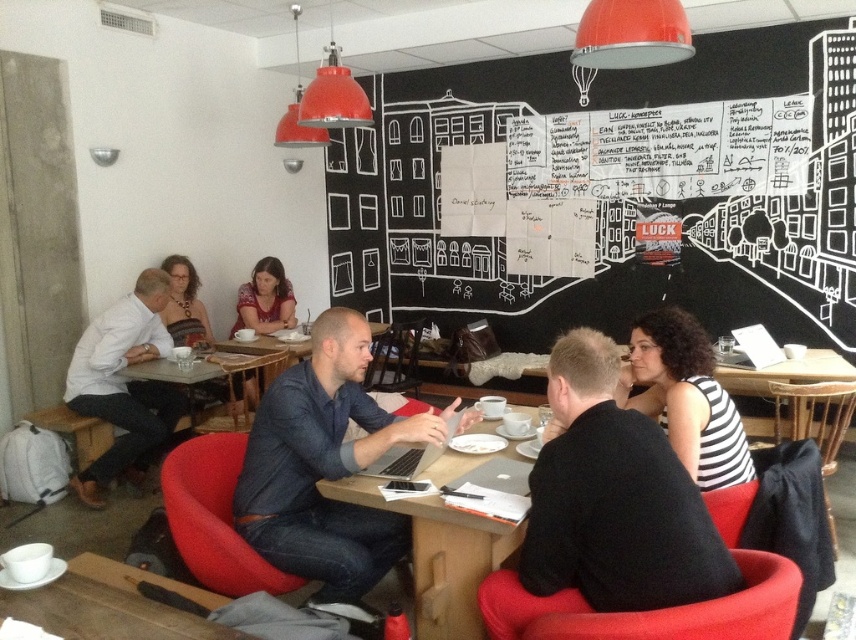
This screenshot has height=640, width=856. What do you see at coordinates (441, 556) in the screenshot?
I see `wooden table at center` at bounding box center [441, 556].

The width and height of the screenshot is (856, 640). Identify the location of wooden table at center. (441, 556).

At what (x,y) coordinates should I click in order to perform the action: click on wooden table at center. Please return your answer as a coordinate pair (x, y). This screenshot has width=856, height=640. Looking at the image, I should click on (441, 556).

Can you confirm if blackboard at upper right is positioned to the right of wooden table at center?

Correct, you'll find blackboard at upper right to the right of wooden table at center.

Between blackboard at upper right and wooden table at center, which one has less height?

Standing shorter between the two is wooden table at center.

Between point (394, 237) and point (509, 557), which one is positioned behind?

The point (394, 237) is behind.

Where is `blackboard at upper right`? blackboard at upper right is located at coordinates (605, 202).

Is point (405, 74) closer to camera compared to point (116, 609)?

No.

Describe the element at coordinates (605, 202) in the screenshot. I see `blackboard at upper right` at that location.

The height and width of the screenshot is (640, 856). What do you see at coordinates (605, 202) in the screenshot? I see `blackboard at upper right` at bounding box center [605, 202].

Find the location of a particular element. Image resolution: width=856 pixels, height=640 pixels. blackboard at upper right is located at coordinates (605, 202).